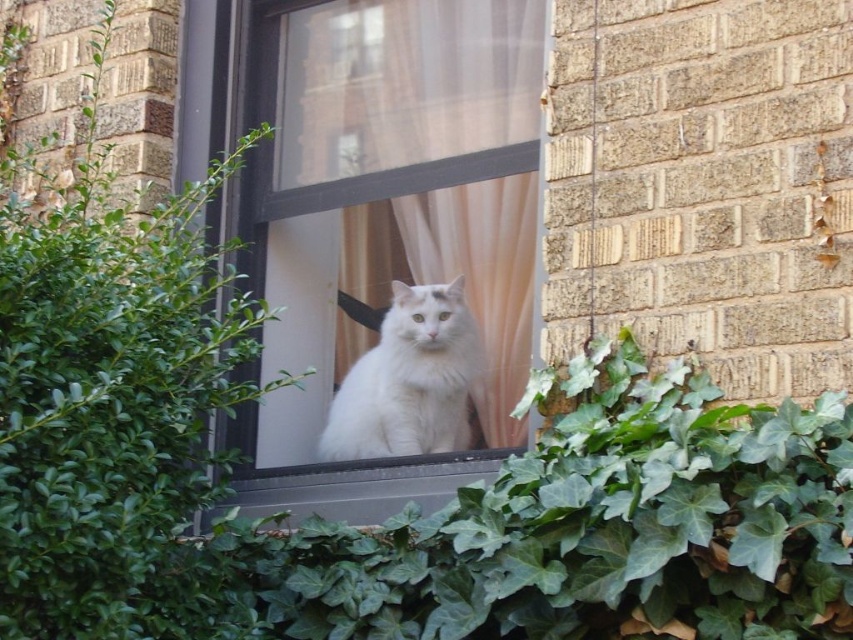
Who is more distant from viewer, (311, 477) or (56, 568)?

Point (311, 477)

Is clear glass window at center taller than green leafy bush at center?

Yes, clear glass window at center is taller than green leafy bush at center.

Is point (403, 104) more distant than point (144, 609)?

That is True.

In order to click on clear glass window at center in this screenshot , I will do `click(384, 220)`.

Which is more to the left, green leafy bush at center or white fluffy cat at center?

green leafy bush at center is more to the left.

Can you confirm if green leafy bush at center is wider than white fluffy cat at center?

Indeed, green leafy bush at center has a greater width compared to white fluffy cat at center.

Which is in front, point (103, 451) or point (450, 413)?

Point (103, 451) is more forward.

Image resolution: width=853 pixels, height=640 pixels. Identify the location of green leafy bush at center. (114, 397).

Can you confirm if clear glass window at center is smaller than white fluffy cat at center?

No, clear glass window at center is not smaller than white fluffy cat at center.

Can you confirm if clear glass window at center is wider than white fluffy cat at center?

Yes.

The width and height of the screenshot is (853, 640). What do you see at coordinates (384, 220) in the screenshot? I see `clear glass window at center` at bounding box center [384, 220].

Where is `clear glass window at center`? This screenshot has width=853, height=640. clear glass window at center is located at coordinates (384, 220).